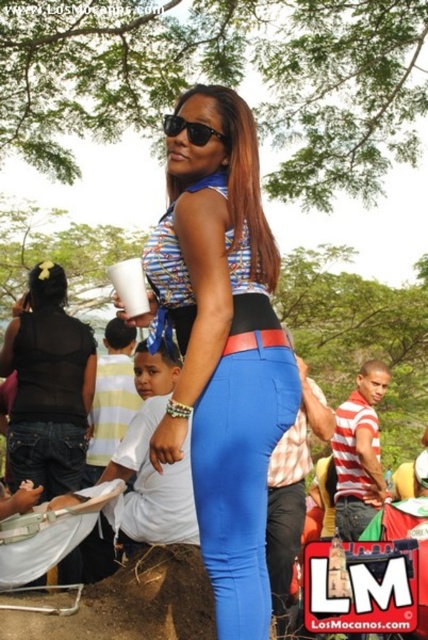
You are a photographer trying to capture a photo of the woman in blue matte pants at center. You need to place a prop 1.5 meters away from her to frame the shot. Is the brown dirt mound at lower left positioned correctly as the prop?

The blue matte pants at center is 1.46 meters from the brown dirt mound at lower left. Since the required distance is 1.5 meters, the brown dirt mound at lower left is slightly closer than needed and thus not positioned correctly as the prop.

You are a photographer trying to capture the blue smooth leggings at center in the image. The camera is focused at point [240,480]. Is the blue smooth leggings at center in focus?

Yes, the blue smooth leggings at center are in focus because the camera is focused at point [240,480], which marks the blue smooth leggings at center.

You are a photographer trying to capture a detailed shot of the blue matte pants at center and the black sheer top at upper left. Which object would you need to zoom in more on to ensure clarity, considering their sizes?

The blue matte pants at center has a lesser width compared to the black sheer top at upper left, so you would need to zoom in more on the blue matte pants at center to ensure clarity due to its smaller size.